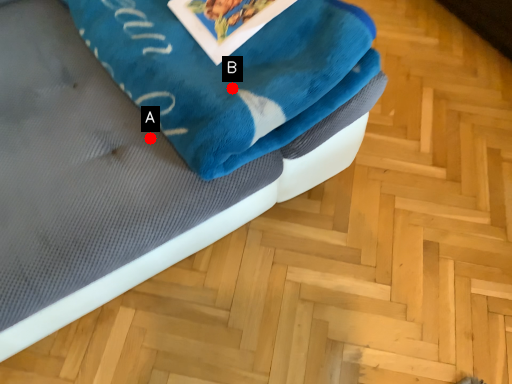
Question: Two points are circled on the image, labeled by A and B beside each circle. Which point is farther from the camera taking this photo?

Choices:
 (A) A is further
 (B) B is further

Answer: (A)